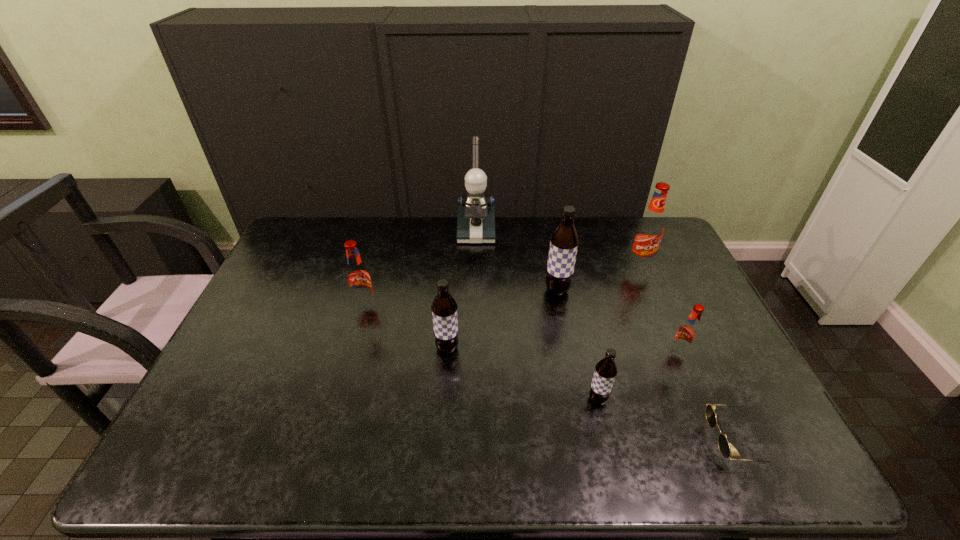
The height and width of the screenshot is (540, 960). Find the location of `microscope`. microscope is located at coordinates (476, 216).

This screenshot has width=960, height=540. What are the coordinates of `gray microscope` in the screenshot? It's located at (476, 216).

Image resolution: width=960 pixels, height=540 pixels. What are the coordinates of `the farthest root beer` in the screenshot? It's located at [650, 228].

Identify the location of the biggest red root beer. (650, 228).

Locate an element on the screen. The height and width of the screenshot is (540, 960). the biggest brown root beer is located at coordinates (564, 241).

In order to click on the second nearest red root beer in this screenshot , I will do `click(358, 279)`.

Where is `the second smallest red root beer`? the second smallest red root beer is located at coordinates (358, 279).

The width and height of the screenshot is (960, 540). I want to click on the second biggest brown root beer, so click(x=444, y=308).

The image size is (960, 540). In order to click on the leftmost brown root beer in this screenshot , I will do `click(444, 308)`.

I want to click on the smallest red root beer, so click(687, 334).